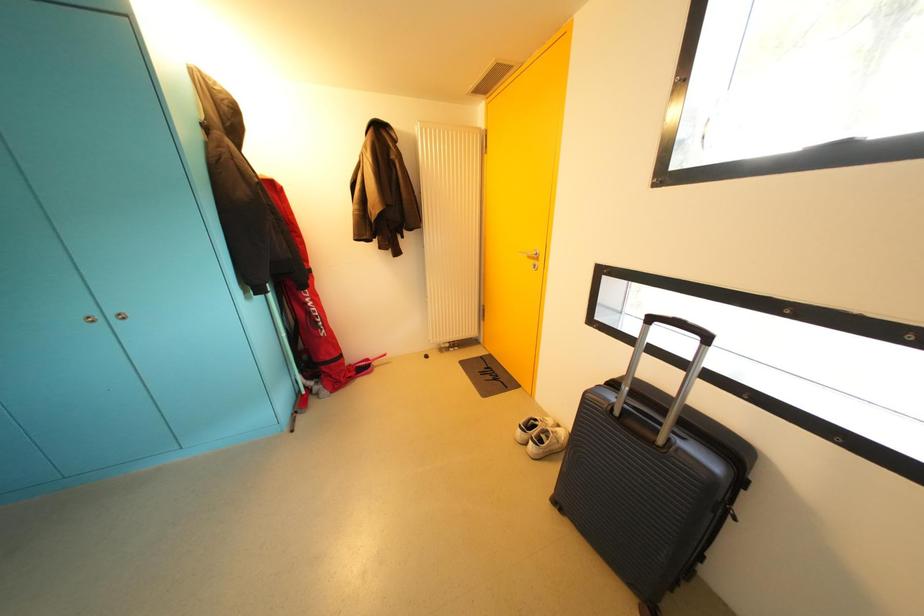
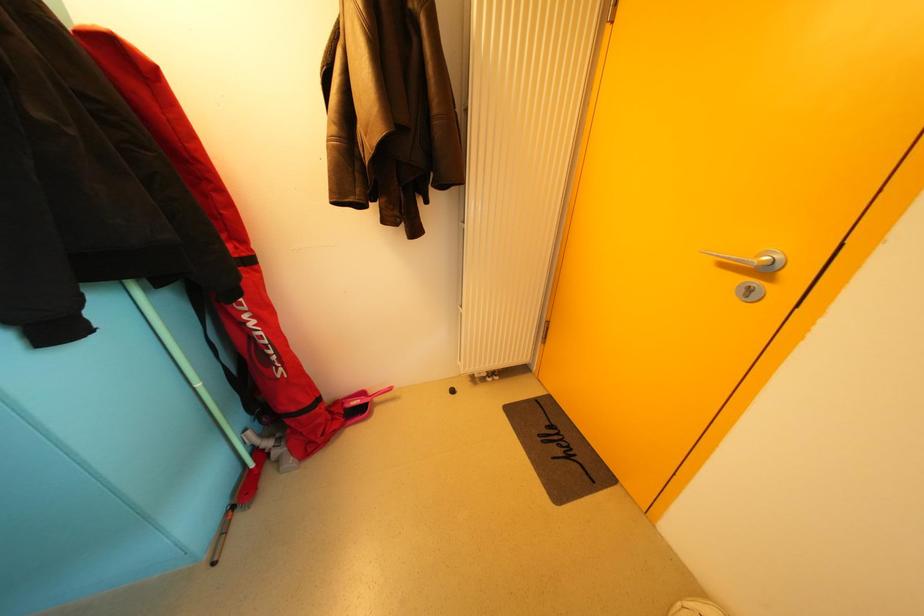
Question: What movement of the cameraman would produce the second image?

Choices:
 (A) Left
 (B) Right
 (C) Forward
 (D) Backward

Answer: (C)